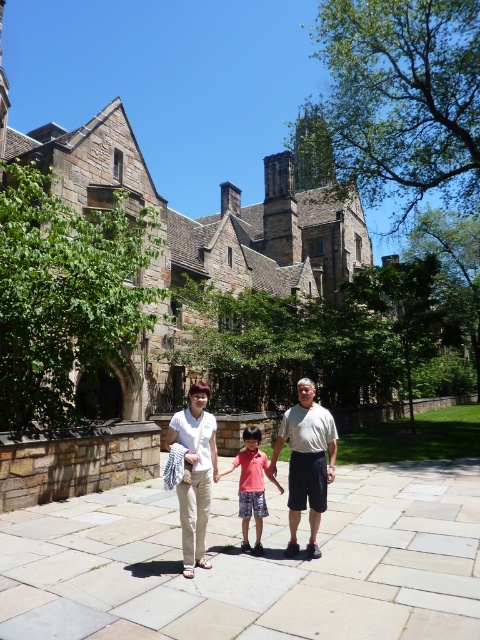
You are a tailor measuring clothing items for a customer. You have a white cotton shirt at center and matte white pants at center. The customer wants to know if they are part of a matching set. Based on their spatial arrangement in the image, can you determine if they are meant to be worn together?

The white cotton shirt at center and matte white pants at center are 28.92 inches apart from each other. Since the distance between them is significant, they are likely not part of a matching set intended to be worn together.

You are a photographer standing in front of the historic stone building. You notice the white cotton shirt at center and the light beige pants at center. Which one is positioned lower in the image?

The white cotton shirt at center is located below light beige pants at center, so it is positioned lower in the image.